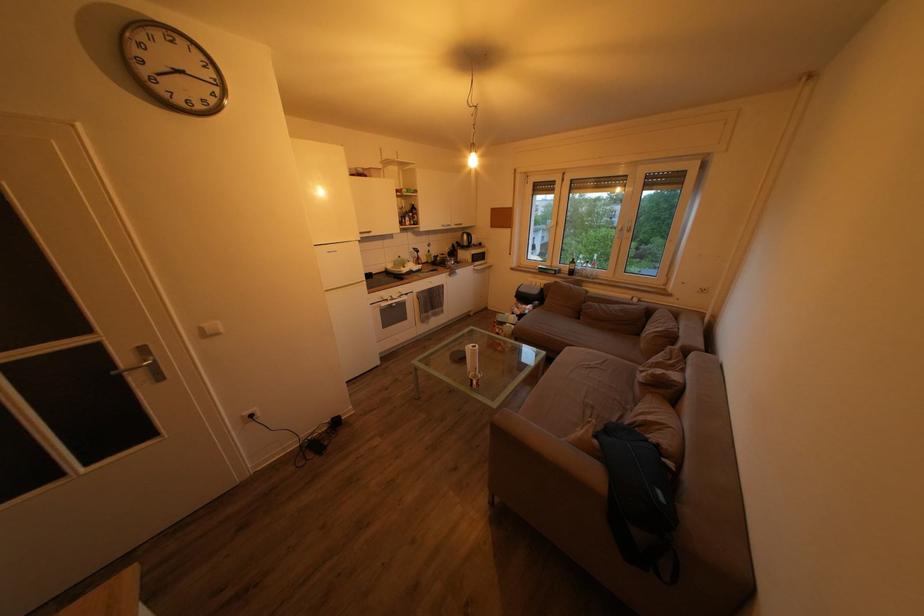
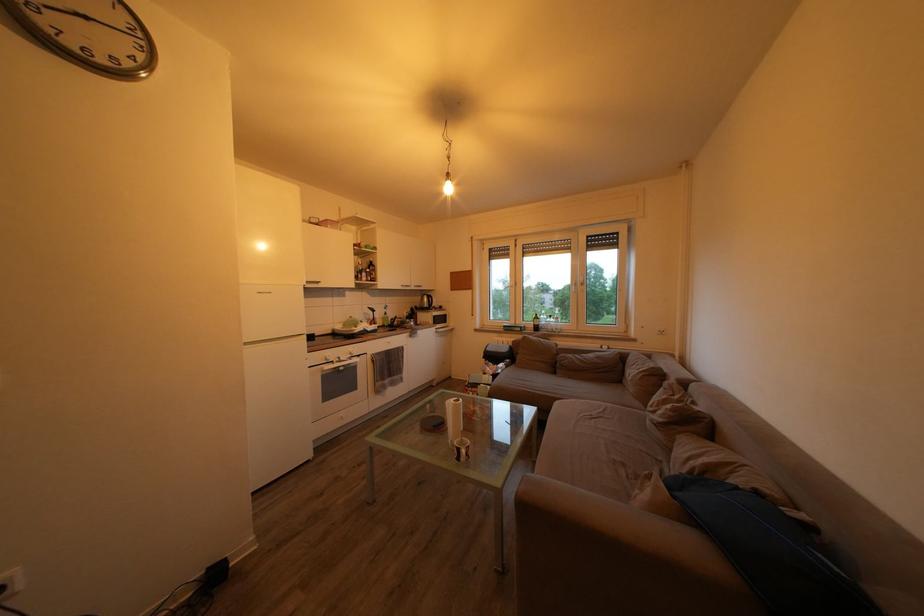
Locate, in the second image, the point that corresponds to point (570, 187) in the first image.

(524, 252)